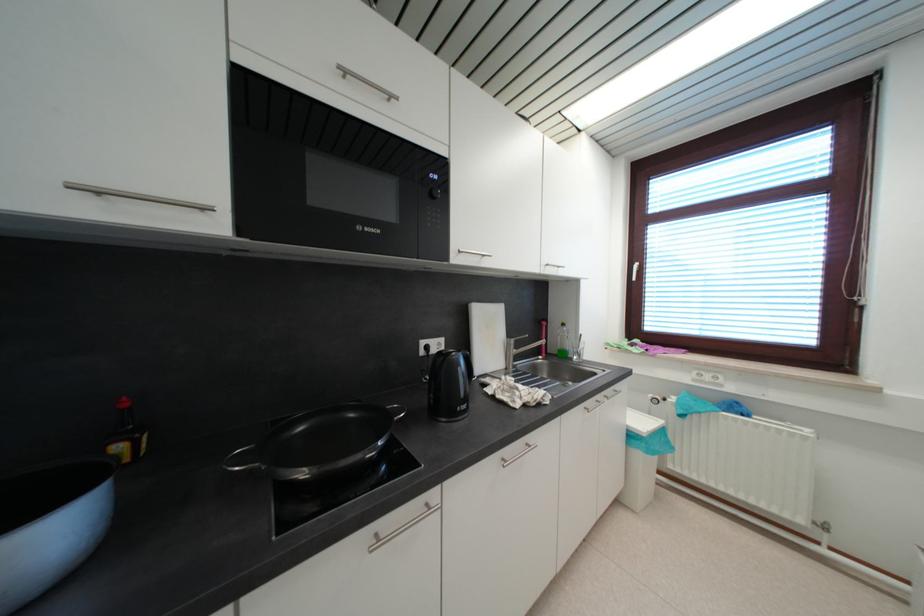
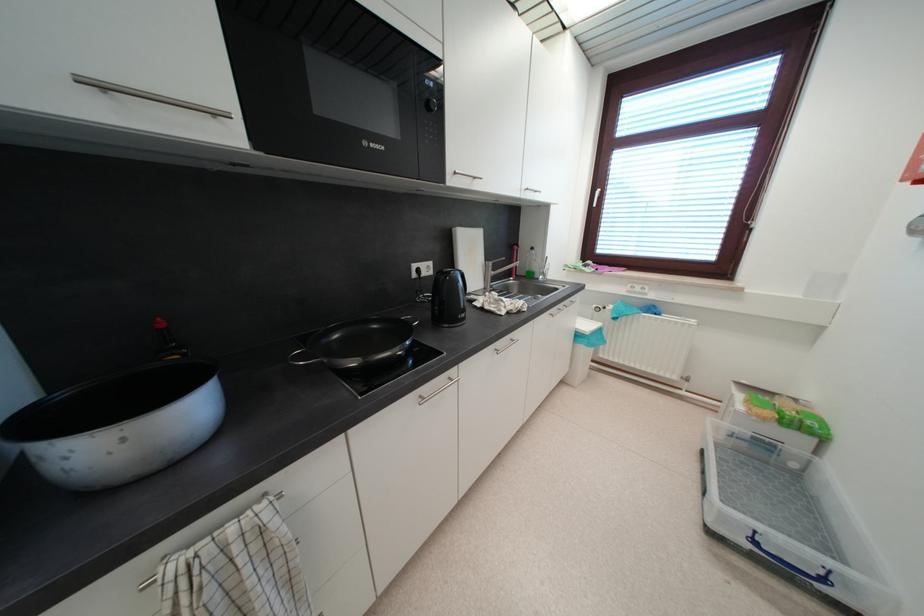
Where in the second image is the point corresponding to point 475,307 from the first image?

(458, 232)